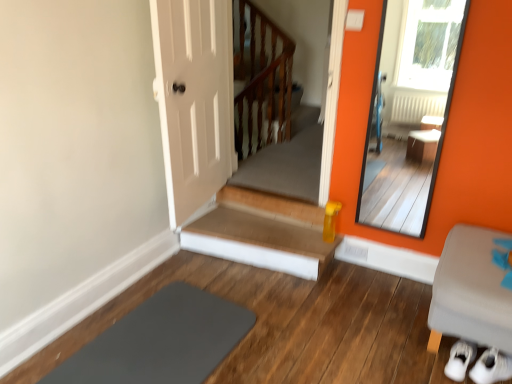
You are a GUI agent. You are given a task and a screenshot of the screen. Output one action in this format:
    pyautogui.click(x=<x>, y=<y>)
    Task: Click on the vacant area located to the right-hand side of slate at lower left
    Image resolution: width=512 pixels, height=384 pixels.
    Given the screenshot: What is the action you would take?
    pyautogui.click(x=302, y=345)